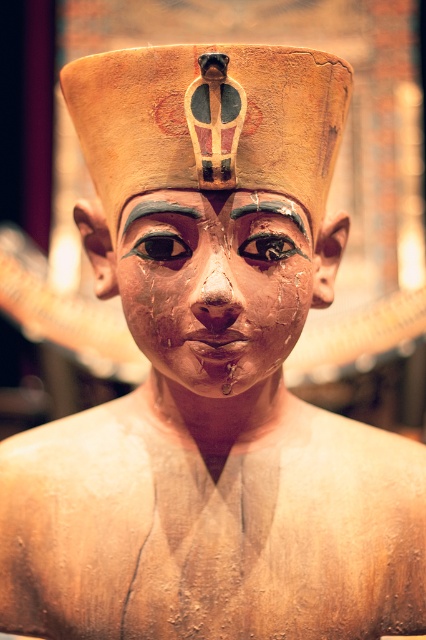
Question: Considering the relative positions of matte clay head at center and shiny black eye at center in the image provided, where is matte clay head at center located with respect to shiny black eye at center?

Choices:
 (A) below
 (B) above

Answer: (B)

Question: Estimate the real-world distances between objects in this image. Which object is farther from the matte gold forehead at center?

Choices:
 (A) matte gold eye at center
 (B) matte wood face at center
 (C) matte clay head at center
 (D) matte brown eyebrow at upper center

Answer: (B)

Question: Considering the real-world distances, which object is farthest from the matte brown eyebrow at center?

Choices:
 (A) shiny black eye at center
 (B) matte gold forehead at center
 (C) matte wood face at center
 (D) matte brown eyebrow at upper center

Answer: (C)

Question: Does matte wood face at center appear over matte gold eye at center?

Choices:
 (A) no
 (B) yes

Answer: (A)

Question: Which object appears closest to the camera in this image?

Choices:
 (A) matte wood face at center
 (B) matte brown eyebrow at upper center
 (C) matte brown eyebrow at center

Answer: (A)

Question: Does matte clay head at center have a greater width compared to matte wood face at center?

Choices:
 (A) yes
 (B) no

Answer: (A)